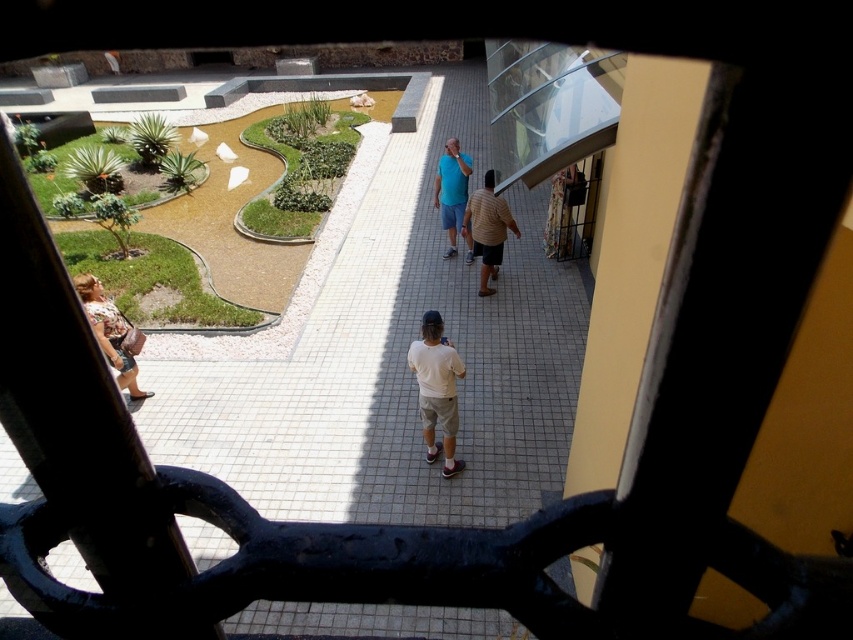
Question: Which point is farther to the camera?

Choices:
 (A) (471, 282)
 (B) (448, 154)
 (C) (496, 273)
 (D) (427, 422)

Answer: (B)

Question: Which object is closer to the camera taking this photo?

Choices:
 (A) blue fabric shirt at center
 (B) white cotton shirt at center
 (C) floral dress at lower left
 (D) white tile floor at center

Answer: (D)

Question: Does white tile floor at center come in front of blue fabric shirt at center?

Choices:
 (A) yes
 (B) no

Answer: (A)

Question: Does white cotton shirt at center have a smaller size compared to floral dress at lower left?

Choices:
 (A) yes
 (B) no

Answer: (B)

Question: Is white tile floor at center to the right of blue fabric shirt at center from the viewer's perspective?

Choices:
 (A) no
 (B) yes

Answer: (A)

Question: Which object is the farthest from the white tile floor at center?

Choices:
 (A) white cotton shirt at center
 (B) striped shirt at center
 (C) floral dress at lower left
 (D) blue fabric shirt at center

Answer: (C)